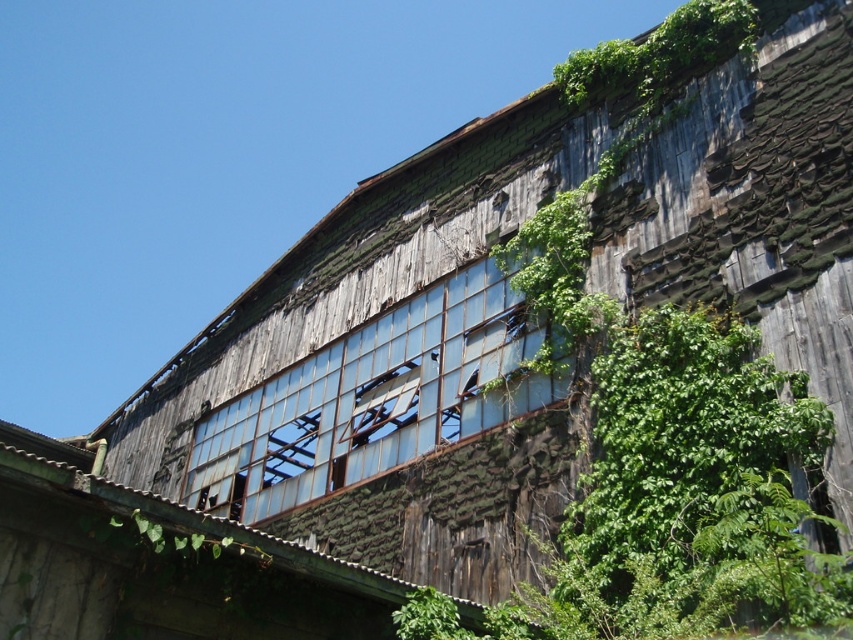
Question: Is transparent glass window at center to the right of green leafy vines at upper right from the viewer's perspective?

Choices:
 (A) no
 (B) yes

Answer: (A)

Question: In this image, where is transparent glass window at center located relative to green leafy vines at upper right?

Choices:
 (A) below
 (B) above

Answer: (A)

Question: Among these objects, which one is farthest from the camera?

Choices:
 (A) transparent glass window at center
 (B) green leafy vines at upper right

Answer: (B)

Question: Which object appears closest to the camera in this image?

Choices:
 (A) transparent glass window at center
 (B) green leafy vines at upper right

Answer: (A)

Question: Is transparent glass window at center bigger than green leafy vines at upper right?

Choices:
 (A) yes
 (B) no

Answer: (B)